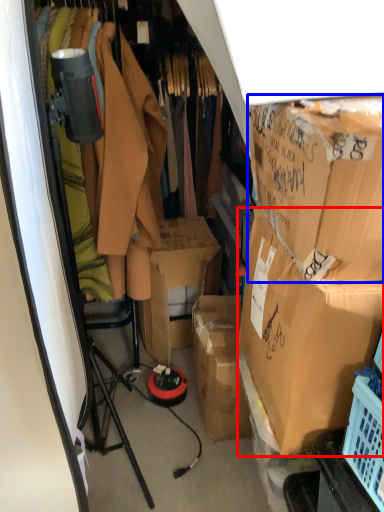
Question: Which object appears farthest to the camera in this image, box (highlighted by a red box) or box (highlighted by a blue box)?

Choices:
 (A) box
 (B) box

Answer: (A)